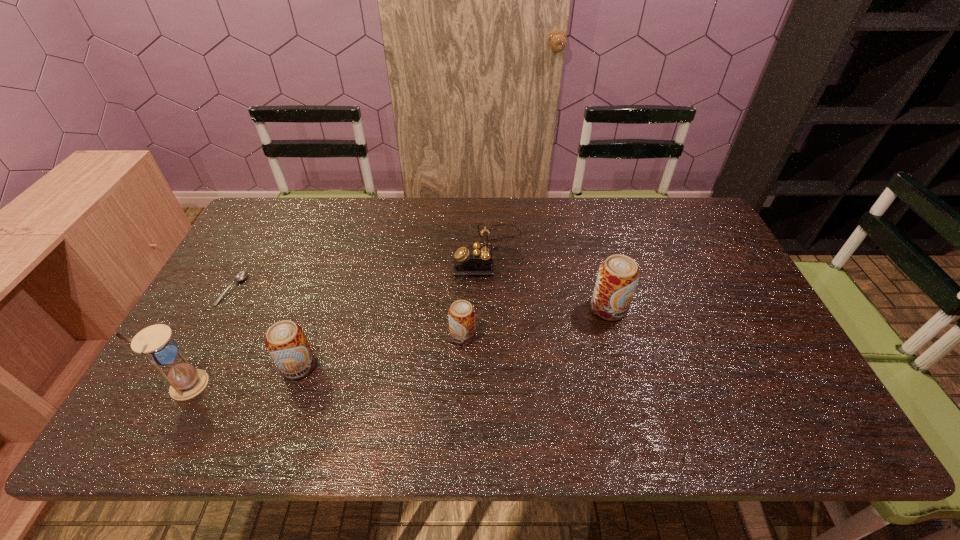
Where is `vacant area situated on the back of the second nearest beer can`? Image resolution: width=960 pixels, height=540 pixels. vacant area situated on the back of the second nearest beer can is located at coordinates (466, 237).

At what (x,y) coordinates should I click in order to perform the action: click on vacant area situated on the right of the second tallest object. Please return your answer as a coordinate pair (x, y). This screenshot has height=540, width=960. Looking at the image, I should click on (728, 308).

You are a GUI agent. You are given a task and a screenshot of the screen. Output one action in this format:
    pyautogui.click(x=<x>, y=<y>)
    Task: Click on the vacant point located on the dial of the telephone
    Image resolution: width=960 pixels, height=540 pixels.
    Given the screenshot: What is the action you would take?
    pos(394,252)

Identify the location of vacant space located 0.350m on the dial of the telephone. This screenshot has width=960, height=540. (343, 252).

Where is `vacant space located on the dial of the telephone`? The height and width of the screenshot is (540, 960). vacant space located on the dial of the telephone is located at coordinates (359, 252).

You are a GUI agent. You are given a task and a screenshot of the screen. Output one action in this format:
    pyautogui.click(x=<x>, y=<y>)
    Task: Click on the vacant space located on the back of the soupspoon
    
    Given the screenshot: What is the action you would take?
    pyautogui.click(x=277, y=206)

Where is `vacant space located on the right of the tallest object`? vacant space located on the right of the tallest object is located at coordinates (275, 384).

Where is `object positioned at the far edge`? object positioned at the far edge is located at coordinates (476, 259).

Locate an element on the screen. beer can at the near edge is located at coordinates (286, 342).

The width and height of the screenshot is (960, 540). I want to click on hourglass at the near edge, so click(x=155, y=342).